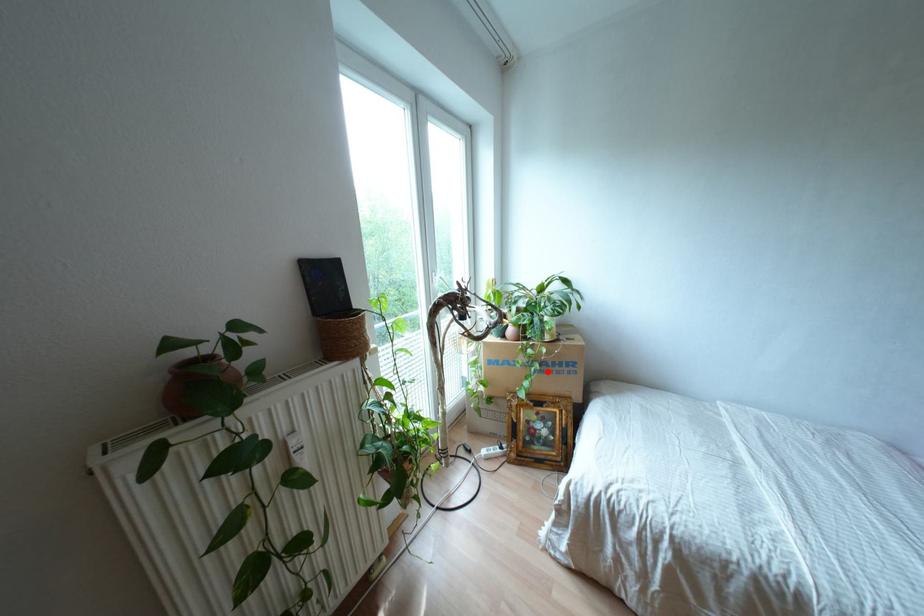
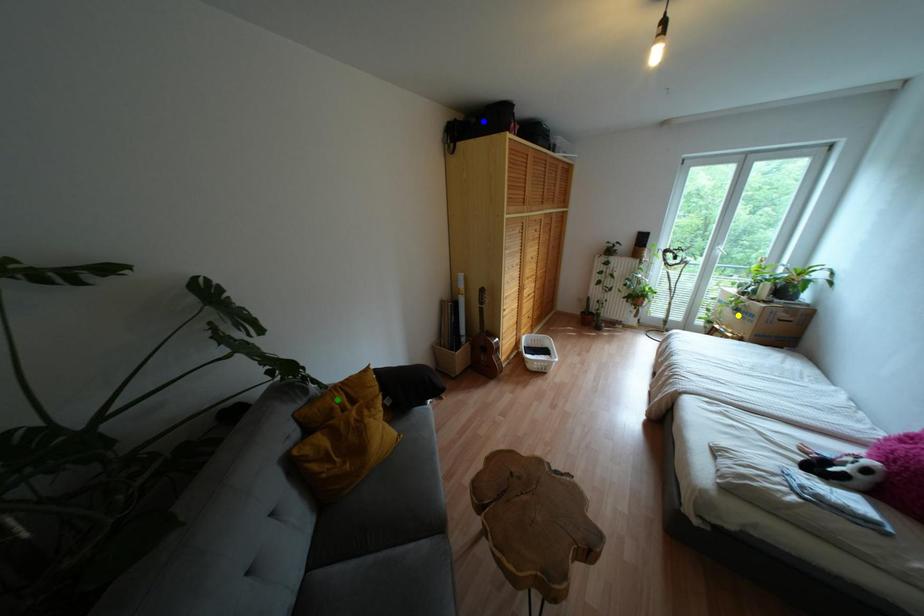
Question: I am providing you with two images of the same scene from different viewpoints. A red point is marked on the first image. You are given multiple points on the second image. In image 2, which mark is for the same physical point as the one in image 1?

Choices:
 (A) green point
 (B) blue point
 (C) yellow point

Answer: (C)